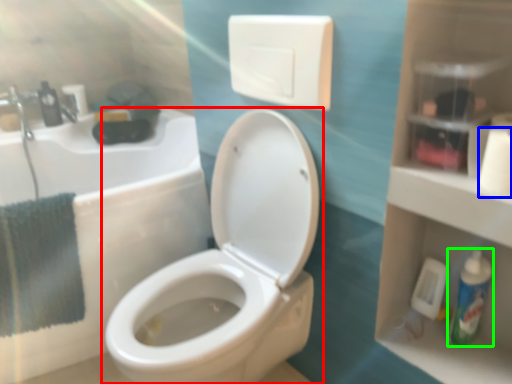
Question: Considering the real-world distances, which object is farthest from toilet (highlighted by a red box)? toilet paper (highlighted by a blue box) or mouthwash (highlighted by a green box)?

Choices:
 (A) toilet paper
 (B) mouthwash

Answer: (A)